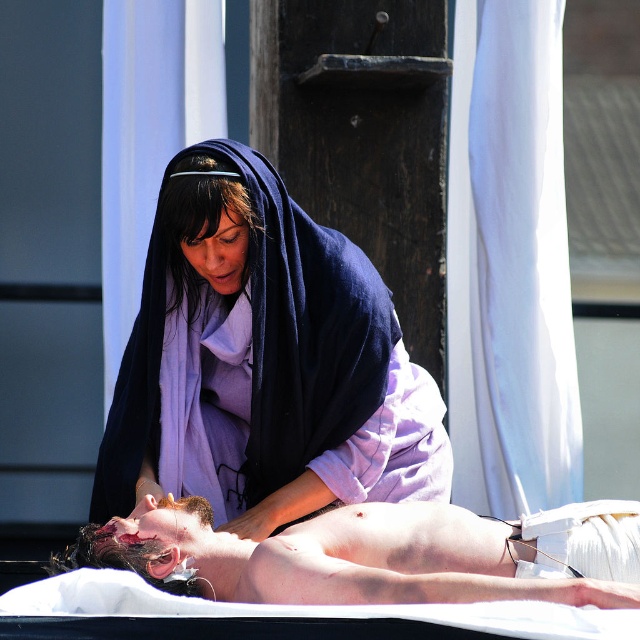
You are a medical professional assessing the scene. You notice the matte purple robe at center and the smooth skin body at center. Which object is located to the left of the other?

The matte purple robe at center is positioned on the left side of smooth skin body at center.

You are a medical professional assessing the scene. The matte purple robe at center and the smooth skin body at center are both at the center of the image. Which object takes up more visual space?

The matte purple robe at center is larger in size than the smooth skin body at center, so it occupies more visual space in the image.

You are a photographer standing in front of the scene. You want to take a photo focusing on the point at point (x=237, y=312) and point (x=572, y=588). Which point is closer to your camera?

Point (x=572, y=588) is closer to the camera because the description states that point (x=237, y=312) is further away from the camera than point (x=572, y=588).